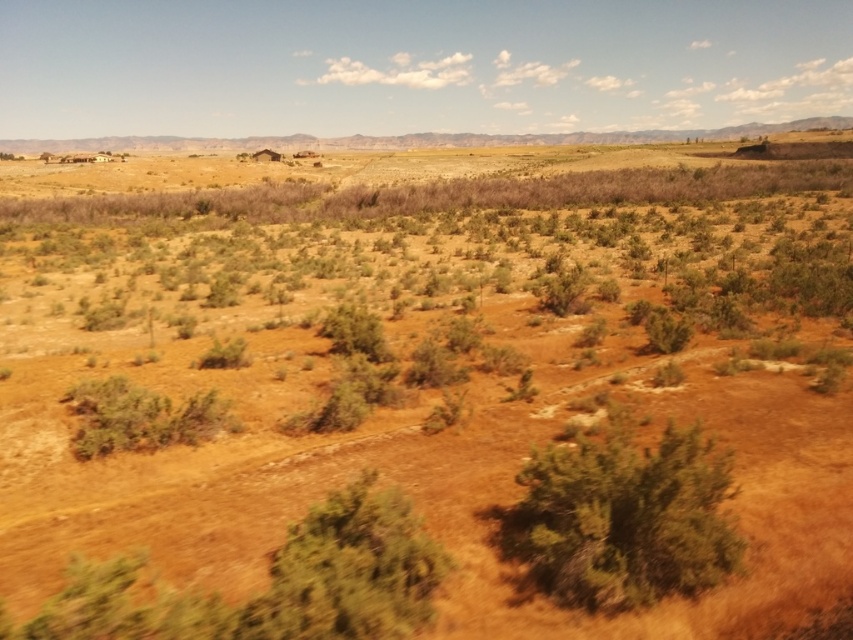
Which is more to the right, green leafy bush at center or green leafy bush at lower center?

green leafy bush at center is more to the right.

In order to click on green leafy bush at center in this screenshot , I will do `click(624, 518)`.